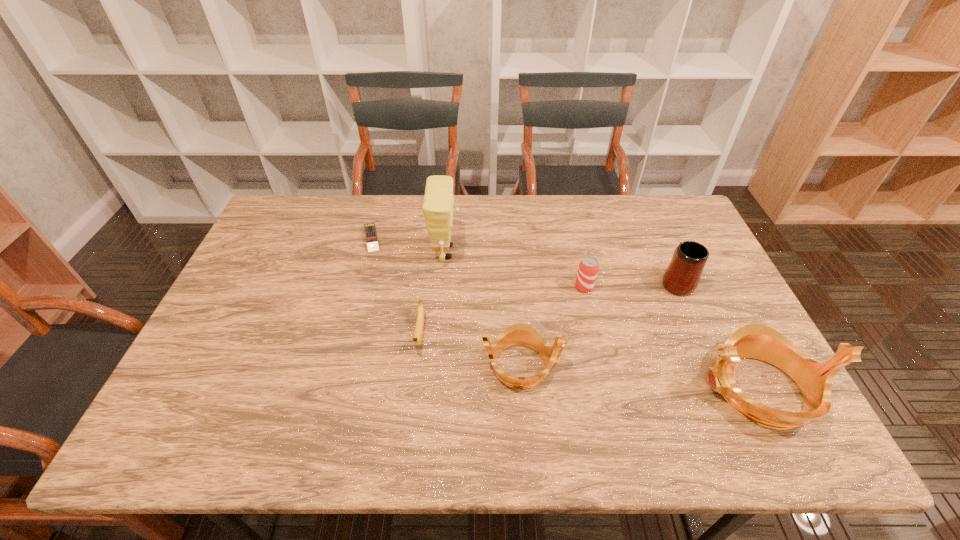
This screenshot has height=540, width=960. In the image, there is a desktop. Find the location of `vacant space at the near left corner`. vacant space at the near left corner is located at coordinates (205, 376).

Locate an element on the screen. free space at the near right corner of the desktop is located at coordinates (748, 394).

What are the coordinates of `vacant region between the right tiara and the shorter tiara` in the screenshot? It's located at (640, 377).

You are a GUI agent. You are given a task and a screenshot of the screen. Output one action in this format:
    pyautogui.click(x=<x>, y=<y>)
    Task: Click on the free point between the beer can and the second shortest object
    
    Given the screenshot: What is the action you would take?
    pyautogui.click(x=502, y=310)

Identify the location of empty space between the beer can and the third tallest object. Image resolution: width=960 pixels, height=540 pixels. (630, 285).

Find the location of a particular element. This screenshot has height=540, width=960. free spot between the fourth object from right to left and the shortest object is located at coordinates (446, 301).

The height and width of the screenshot is (540, 960). Identify the location of vacant area between the second shortest object and the leftmost object. (396, 286).

Image resolution: width=960 pixels, height=540 pixels. I want to click on vacant region between the third tallest object and the second shortest object, so click(x=548, y=308).

Where is `unoccupied position between the leftmost object and the tallest object`? Image resolution: width=960 pixels, height=540 pixels. unoccupied position between the leftmost object and the tallest object is located at coordinates (409, 245).

Where is `empty space that is in between the sixth tallest object and the shorter tiara`? empty space that is in between the sixth tallest object and the shorter tiara is located at coordinates (471, 350).